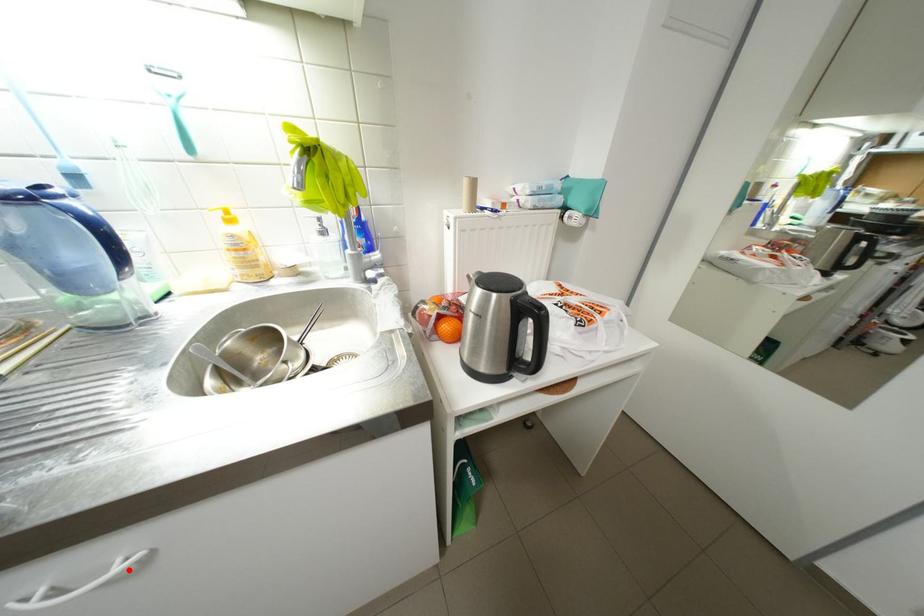
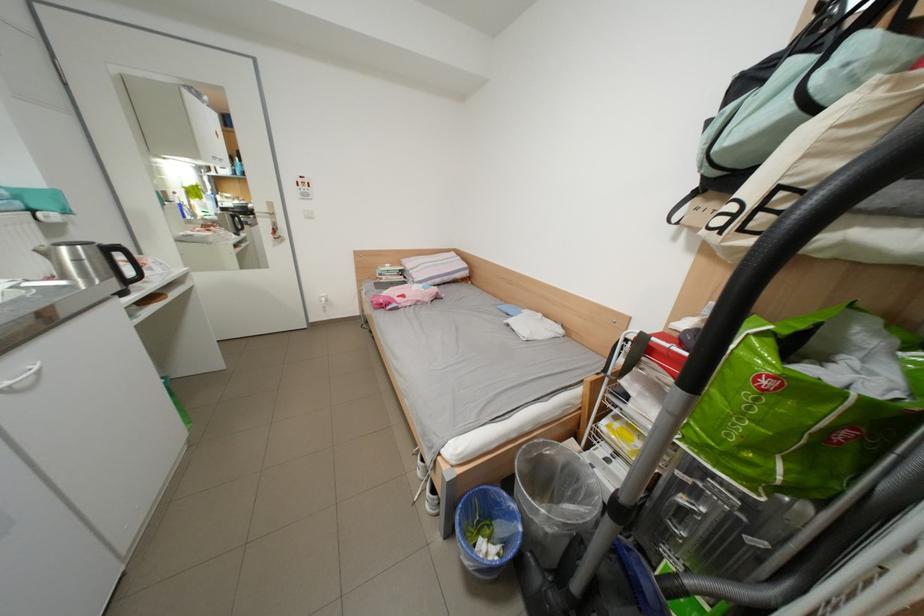
Question: I am providing you with two images of the same scene from different viewpoints. Given a red point in image1, look at the same physical point in image2. Is it:

Choices:
 (A) Closer to the viewpoint
 (B) Farther from the viewpoint

Answer: (B)